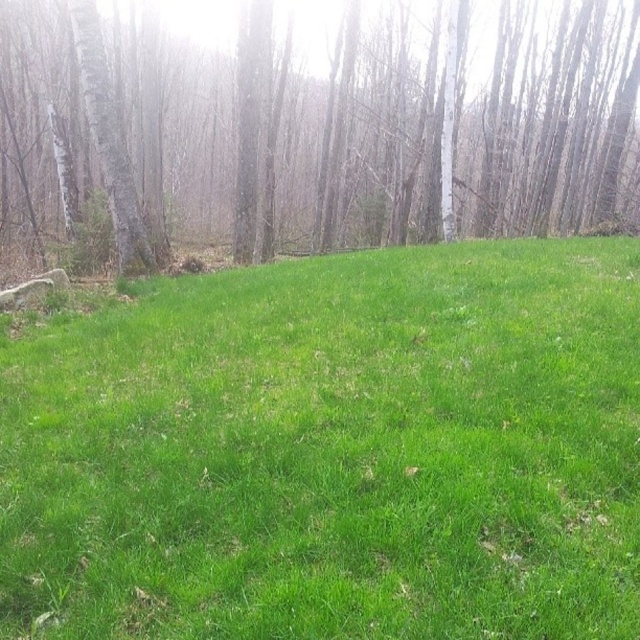
Does point (257, 193) come closer to viewer compared to point (109, 136)?

No, it is behind (109, 136).

Is point (109, 51) in front of point (129, 248)?

No, it is behind (129, 248).

The height and width of the screenshot is (640, 640). Identify the location of bare wood trees at upper center. (314, 131).

Is green grassy field at center thinner than smooth bark tree at left?

Yes.

Which is behind, point (602, 300) or point (147, 260)?

Point (147, 260)

Which is in front, point (348, 474) or point (72, 20)?

Point (348, 474)

Where is `green grassy field at center`? Image resolution: width=640 pixels, height=640 pixels. green grassy field at center is located at coordinates (332, 451).

Is the position of green grassy field at center less distant than that of bare wood trees at upper center?

Yes, green grassy field at center is in front of bare wood trees at upper center.

Find the location of a particular element. The height and width of the screenshot is (640, 640). green grassy field at center is located at coordinates (332, 451).

Identify the location of green grassy field at center. The image size is (640, 640). (332, 451).